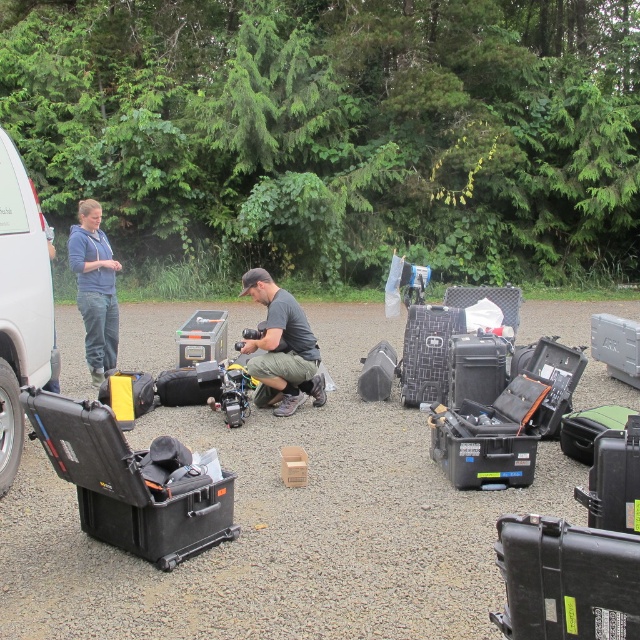
Does black hard case at center have a smaller size compared to textured black suitcase at center?

Incorrect, black hard case at center is not smaller in size than textured black suitcase at center.

Who is positioned more to the left, black hard case at center or textured black suitcase at center?

black hard case at center

Between point (189, 550) and point (444, 330), which one is positioned behind?

The point (444, 330) is more distant.

Find the location of a particular element. This screenshot has height=640, width=640. black hard case at center is located at coordinates (132, 483).

Does black plastic cases at center have a lesser width compared to white matte van at left?

No.

Does point (228, 454) come in front of point (33, 205)?

That is False.

Identify the location of black plastic cases at center. (285, 525).

In the scene shown: Can you confirm if black plastic cases at center is taller than black hard shell suitcase at center?

Yes, black plastic cases at center is taller than black hard shell suitcase at center.

Who is positioned more to the right, black plastic cases at center or black hard shell suitcase at center?

black hard shell suitcase at center is more to the right.

The height and width of the screenshot is (640, 640). I want to click on black plastic cases at center, so click(285, 525).

Identify the location of black plastic cases at center. (285, 525).